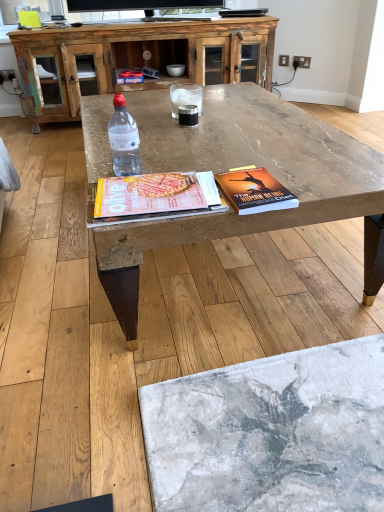
Find the location of a particular element. This screenshot has width=384, height=512. unoccupied space behind black rubberized cup at center is located at coordinates (175, 120).